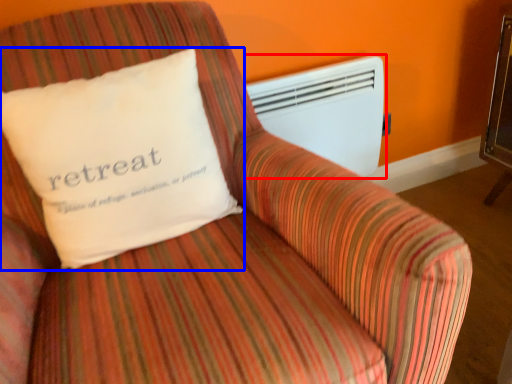
Question: Which point is further to the camera, air conditioning (highlighted by a red box) or pillow (highlighted by a blue box)?

Choices:
 (A) air conditioning
 (B) pillow

Answer: (A)